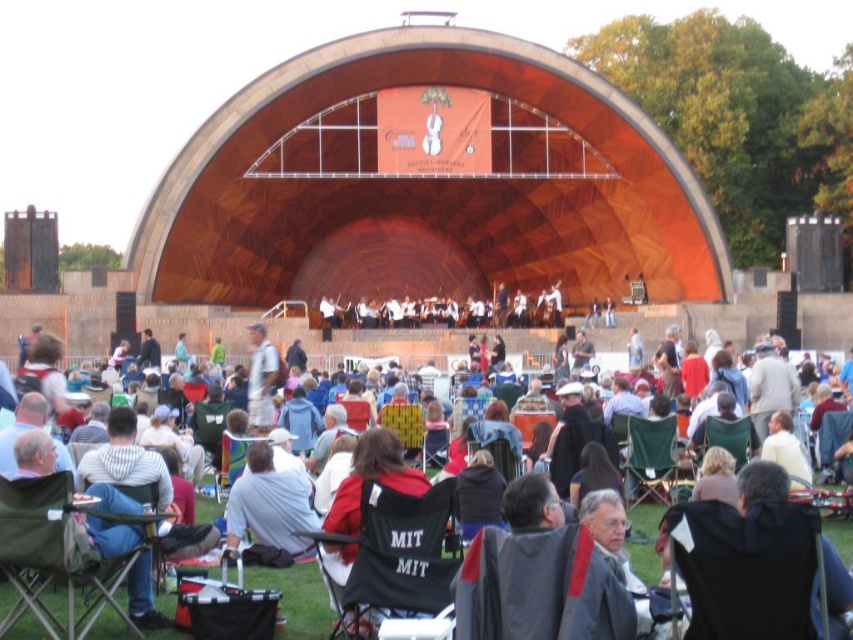
You are an attendee at the concert and want to see the stage clearly. You are currently standing behind the light gray fabric jacket at center. Is the green fabric chair at lower left blocking your view? Please explain.

The green fabric chair at lower left is in front of the light gray fabric jacket at center, so if you are behind the jacket, the chair is between you and the stage. This would block your view.

You are attending a concert at the Hatch Shell and want to find a spot where you can see both the wooden amphitheater at center and the black fabric chair at center clearly. Based on their positions, which object is higher and would block the view of the other if you stand behind it?

The wooden amphitheater at center is above the black fabric chair at center, so if you stand behind the wooden amphitheater at center, it would block the view of the black fabric chair at center.